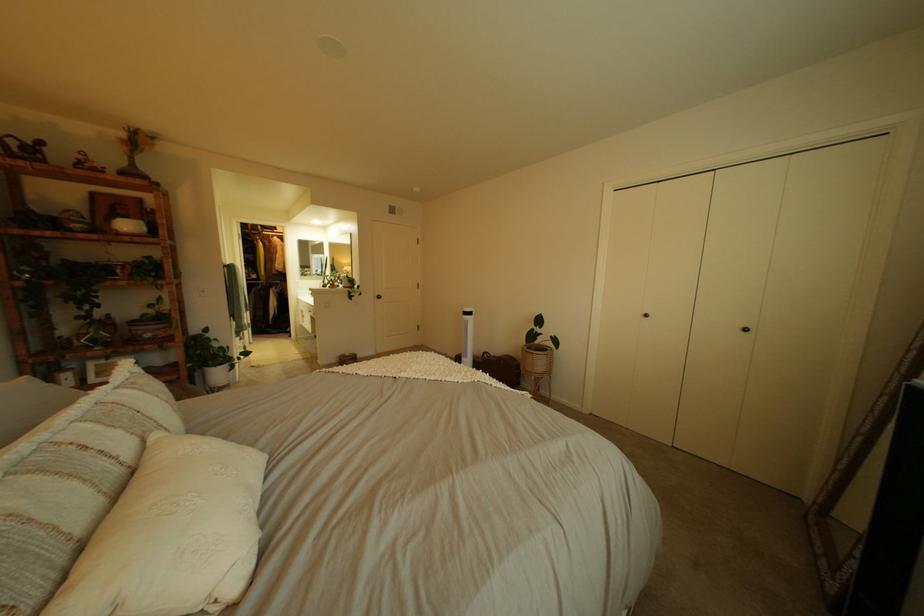
Where would you lift the white decorative pillow? Please return your answer as a coordinate pair (x, y).

(176, 532)